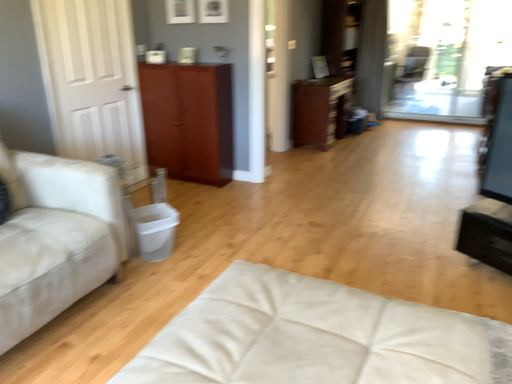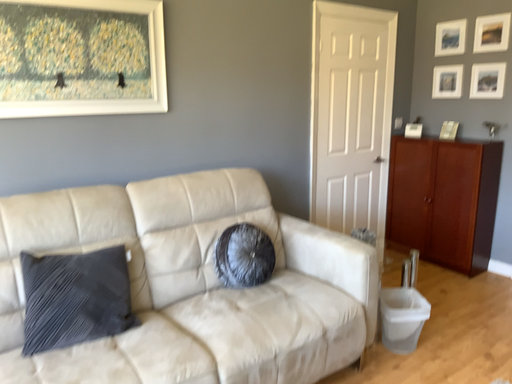
Question: How did the camera likely rotate when shooting the video?

Choices:
 (A) rotated downward
 (B) rotated upward

Answer: (B)